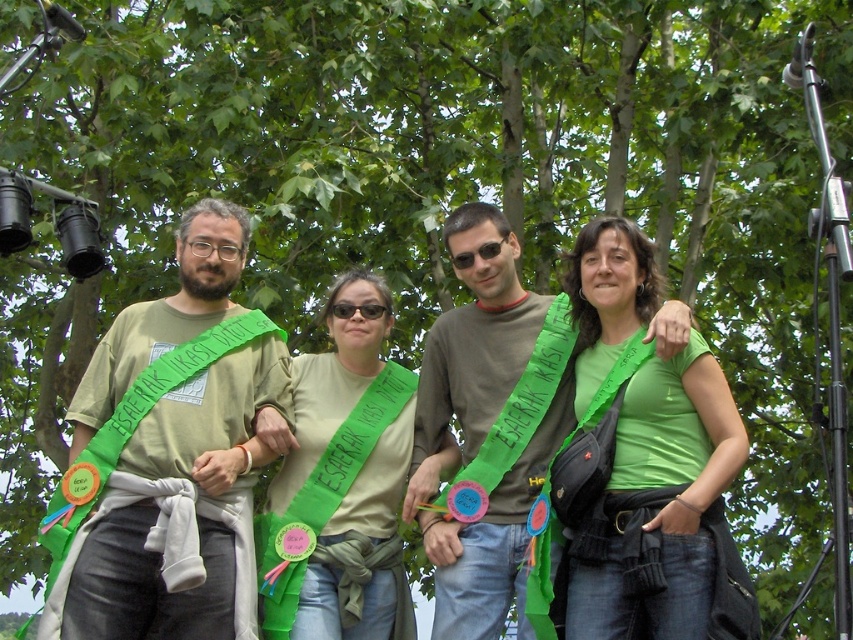
Question: Which point is farther from the camera taking this photo?

Choices:
 (A) pos(480,525)
 (B) pos(321,636)
 (C) pos(672,600)
 (D) pos(187,404)

Answer: (D)

Question: Which object is positioned farthest from the matte green sash at left?

Choices:
 (A) green matte shirt at center
 (B) green fabric sash at center
 (C) matte brown shirt at center

Answer: (A)

Question: Which of these objects is positioned farthest from the green matte shirt at center?

Choices:
 (A) matte brown shirt at center
 (B) green fabric sash at center

Answer: (B)

Question: Where is green matte shirt at center located in relation to matte brown shirt at center in the image?

Choices:
 (A) left
 (B) right

Answer: (B)

Question: Is green matte shirt at center bigger than matte brown shirt at center?

Choices:
 (A) no
 (B) yes

Answer: (B)

Question: Does green fabric sash at center have a larger size compared to matte brown shirt at center?

Choices:
 (A) no
 (B) yes

Answer: (B)